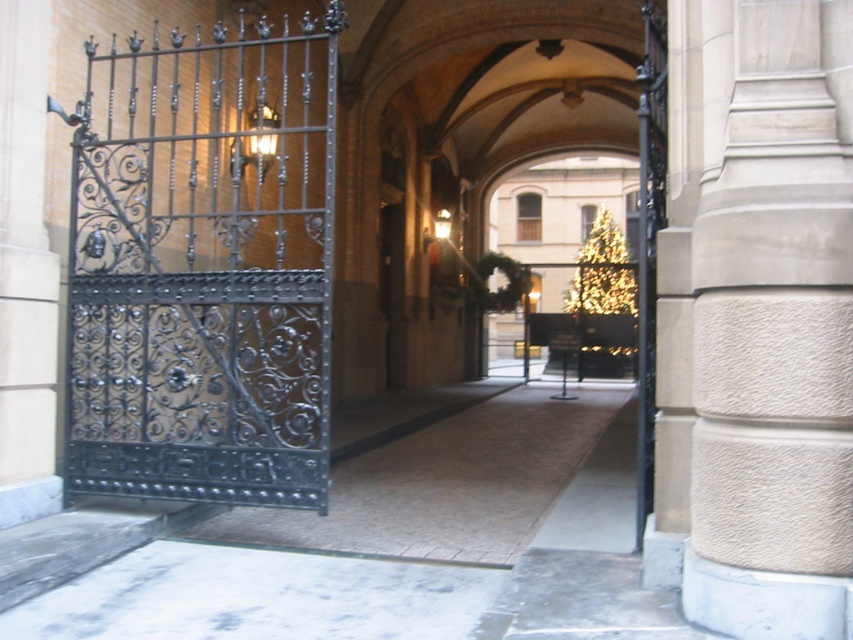
Question: Which point is farther from the camera taking this photo?

Choices:
 (A) (718, 454)
 (B) (296, 371)

Answer: (B)

Question: Which of the following is the closest to the observer?

Choices:
 (A) (300, 500)
 (B) (738, 3)

Answer: (B)

Question: In this image, where is black wrought iron gate at left located relative to smooth stone column at center?

Choices:
 (A) above
 (B) below

Answer: (A)

Question: Can you confirm if black wrought iron gate at left is bigger than smooth stone column at center?

Choices:
 (A) no
 (B) yes

Answer: (A)

Question: Does black wrought iron gate at left have a smaller size compared to smooth stone column at center?

Choices:
 (A) no
 (B) yes

Answer: (B)